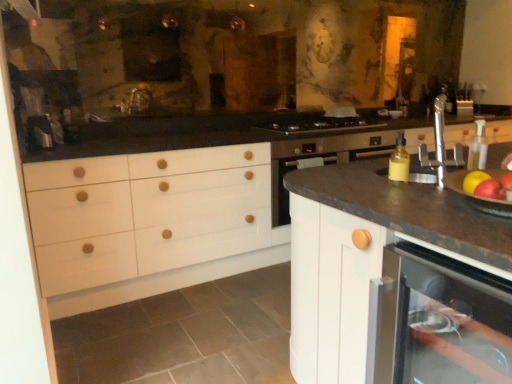
The image size is (512, 384). I want to click on shiny red apple at right, arranged as the 1th apple when viewed from the back, so [474, 180].

What are the coordinates of `white matte cabinet at center` in the screenshot? It's located at (390, 307).

Describe the element at coordinates (438, 321) in the screenshot. I see `matte white dishwasher at lower right` at that location.

This screenshot has height=384, width=512. What do you see at coordinates (487, 185) in the screenshot? I see `red matte apple at right, which is the 1th apple from front to back` at bounding box center [487, 185].

I want to click on shiny red apple at right, arranged as the 1th apple when viewed from the back, so click(474, 180).

From the image's perspective, would you say matte white dishwasher at lower right is shown under white matte cabinet at center?

Yes, from the image's perspective, matte white dishwasher at lower right is beneath white matte cabinet at center.

Which is nearer, (411, 329) or (404, 319)?

Positioned in front is point (404, 319).

In the scene shown: Considering the relative sizes of matte white dishwasher at lower right and white matte cabinet at center in the image provided, is matte white dishwasher at lower right thinner than white matte cabinet at center?

Yes, matte white dishwasher at lower right is thinner than white matte cabinet at center.

Which of these two, matte white dishwasher at lower right or white matte cabinet at center, stands shorter?

matte white dishwasher at lower right.

Considering the positions of point (405, 177) and point (375, 305), is point (405, 177) closer or farther from the camera than point (375, 305)?

Point (405, 177) appears to be farther away from the viewer than point (375, 305).

Is yellow matte bottle at right directly adjacent to matte white dishwasher at lower right?

They are not placed beside each other.

Is yellow matte bottle at right taller or shorter than matte white dishwasher at lower right?

yellow matte bottle at right is shorter than matte white dishwasher at lower right.

In the scene shown: Is matte white dishwasher at lower right at the back of yellow matte bottle at right?

No, yellow matte bottle at right is not facing the opposite direction of matte white dishwasher at lower right.

Which is nearer, (483, 175) or (285, 120)?

Clearly, point (483, 175) is closer to the camera than point (285, 120).

Could you measure the distance between shiny red apple at right, which ranks as the second apple in front-to-back order, and stainless steel gas stove at center?

A distance of 6.22 feet exists between shiny red apple at right, which ranks as the second apple in front-to-back order, and stainless steel gas stove at center.

Relative to stainless steel gas stove at center, is shiny red apple at right, which ranks as the second apple in front-to-back order, in front or behind?

Visually, shiny red apple at right, which ranks as the second apple in front-to-back order, is located in front of stainless steel gas stove at center.

Is stainless steel gas stove at center aimed at matte white dishwasher at lower right?

No, stainless steel gas stove at center is not facing towards matte white dishwasher at lower right.

Measure the distance between stainless steel gas stove at center and matte white dishwasher at lower right.

stainless steel gas stove at center and matte white dishwasher at lower right are 6.58 feet apart from each other.

Considering the relative positions of stainless steel gas stove at center and matte white dishwasher at lower right in the image provided, is stainless steel gas stove at center to the left or to the right of matte white dishwasher at lower right?

Based on their positions, stainless steel gas stove at center is located to the left of matte white dishwasher at lower right.

Who is smaller, stainless steel gas stove at center or matte white dishwasher at lower right?

With smaller size is stainless steel gas stove at center.

Identify the location of bottle behind the white matte cabinet at center. pyautogui.click(x=399, y=161).

Who is smaller, yellow matte bottle at right or white matte cabinet at center?

Smaller between the two is yellow matte bottle at right.

Based on the photo, is yellow matte bottle at right far from white matte cabinet at center?

No, yellow matte bottle at right is not far from white matte cabinet at center.

Could you tell me if yellow matte bottle at right is turned towards white matte cabinet at center?

No, yellow matte bottle at right is not aimed at white matte cabinet at center.

Does yellow matte bottle at right lie behind red matte apple at right, the second apple from the back?

Yes, it is.

Between point (401, 133) and point (465, 192), which one is positioned in front?

The point (465, 192) is closer.

Looking at this image, are yellow matte bottle at right and red matte apple at right, which is the 1th apple from front to back, far apart?

No, there isn't a large distance between yellow matte bottle at right and red matte apple at right, which is the 1th apple from front to back.

Image resolution: width=512 pixels, height=384 pixels. I want to click on bottle on the left of the red matte apple at right, the second apple from the back, so click(399, 161).

How distant is stainless steel gas stove at center from white matte cabinet at center?

stainless steel gas stove at center is 1.77 meters away from white matte cabinet at center.

Which is in front, stainless steel gas stove at center or white matte cabinet at center?

Positioned in front is white matte cabinet at center.

Is stainless steel gas stove at center touching white matte cabinet at center?

No.

Is stainless steel gas stove at center wider than white matte cabinet at center?

In fact, stainless steel gas stove at center might be narrower than white matte cabinet at center.

I want to click on dish washer that is on the left side of white matte cabinet at center, so click(438, 321).

Where is `dish washer below the yellow matte bottle at right (from the image's perspective)`? dish washer below the yellow matte bottle at right (from the image's perspective) is located at coordinates (438, 321).

Estimate the real-world distances between objects in this image. Which object is further from matte white dishwasher at lower right, white matte cabinet at center or red matte apple at right, which is the 1th apple from front to back?

Based on the image, red matte apple at right, which is the 1th apple from front to back, appears to be further to matte white dishwasher at lower right.

Which object lies nearer to the anchor point shiny red apple at right, which ranks as the second apple in front-to-back order, white matte cabinet at center or yellow matte bottle at right?

The object closer to shiny red apple at right, which ranks as the second apple in front-to-back order, is yellow matte bottle at right.

Considering their positions, is stainless steel gas stove at center positioned further to red matte apple at right, which is the 1th apple from front to back, than yellow matte bottle at right?

stainless steel gas stove at center.

Estimate the real-world distances between objects in this image. Which object is further from yellow matte bottle at right, red matte apple at right, which is the 1th apple from front to back, or shiny red apple at right, which ranks as the second apple in front-to-back order?

Based on the image, red matte apple at right, which is the 1th apple from front to back, appears to be further to yellow matte bottle at right.

From the image, which object appears to be farther from white matte cabinet at center, shiny red apple at right, arranged as the 1th apple when viewed from the back, or red matte apple at right, which is the 1th apple from front to back?

Based on the image, shiny red apple at right, arranged as the 1th apple when viewed from the back, appears to be further to white matte cabinet at center.

Based on their spatial positions, is red matte apple at right, which is the 1th apple from front to back, or yellow matte bottle at right closer to white matte cabinet at center?

red matte apple at right, which is the 1th apple from front to back, is positioned closer to the anchor white matte cabinet at center.

When comparing their distances from yellow matte bottle at right, does white matte cabinet at center or matte white dishwasher at lower right seem closer?

white matte cabinet at center lies closer to yellow matte bottle at right than the other object.

When comparing their distances from matte white dishwasher at lower right, does stainless steel gas stove at center or white matte cabinet at center seem further?

Among the two, stainless steel gas stove at center is located further to matte white dishwasher at lower right.

This screenshot has width=512, height=384. Identify the location of bottle positioned between white matte cabinet at center and stainless steel gas stove at center from near to far. (399, 161).

The image size is (512, 384). In order to click on dish washer situated between shiny red apple at right, which ranks as the second apple in front-to-back order, and white matte cabinet at center from left to right in this screenshot , I will do `click(438, 321)`.

Find the location of a particular element. The height and width of the screenshot is (384, 512). dish washer between red matte apple at right, which is the 1th apple from front to back, and white matte cabinet at center, in the horizontal direction is located at coordinates (438, 321).

Where is `bottle between red matte apple at right, which is the 1th apple from front to back, and stainless steel gas stove at center from front to back`? bottle between red matte apple at right, which is the 1th apple from front to back, and stainless steel gas stove at center from front to back is located at coordinates (399, 161).